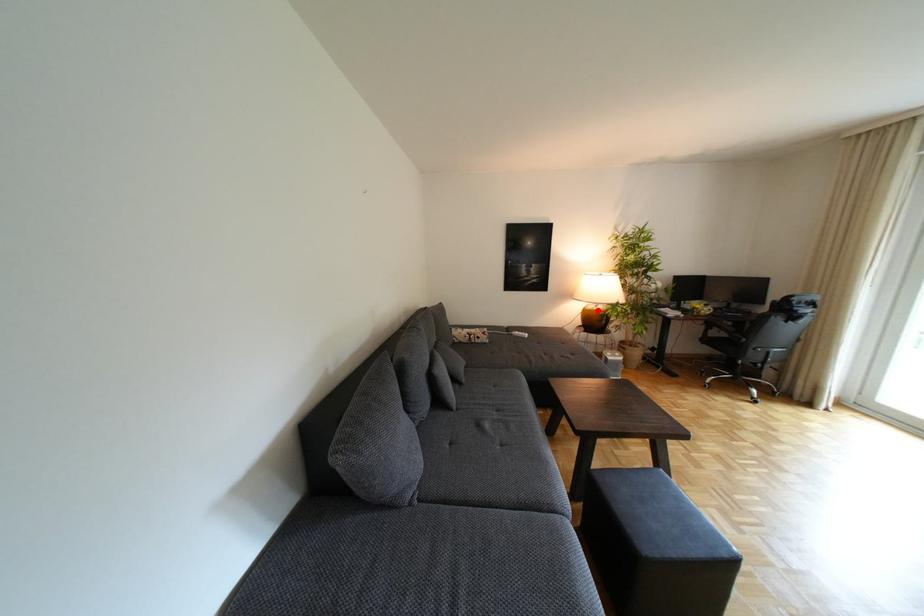
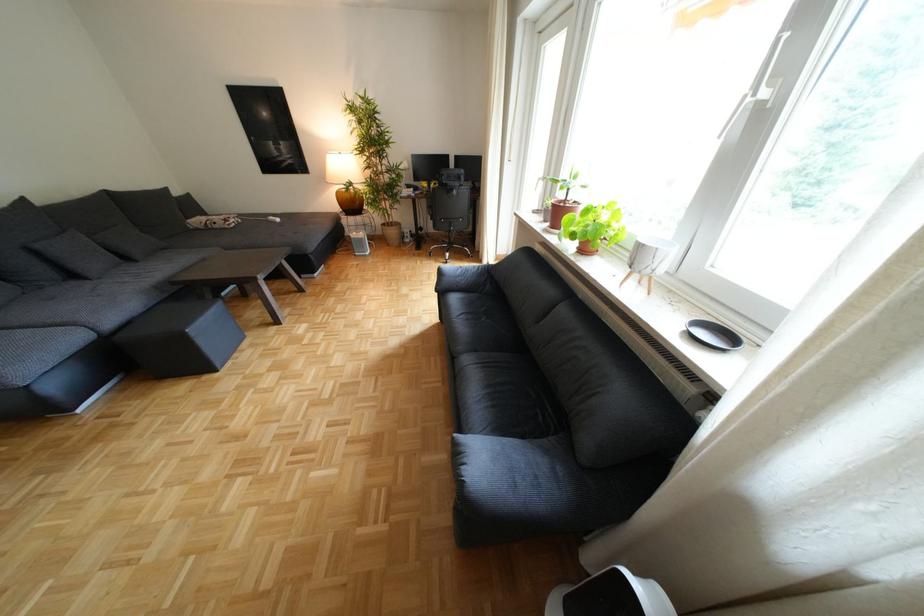
Question: I am providing you with two images of the same scene from different viewpoints. A red point is shown in image1. For the corresponding object point in image2, is it positioned nearer or farther from the camera?

Choices:
 (A) Nearer
 (B) Farther

Answer: (A)